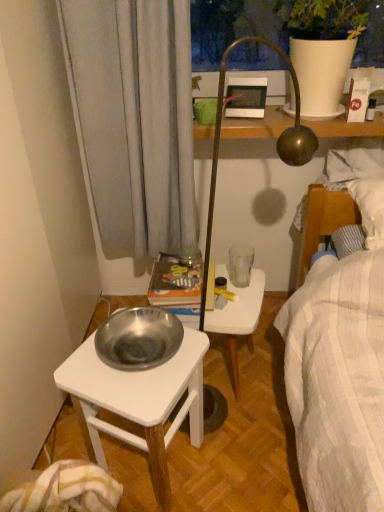
Identify the location of free point below silver metallic bowl at lower left (from a real-world perspective). The width and height of the screenshot is (384, 512). (167, 470).